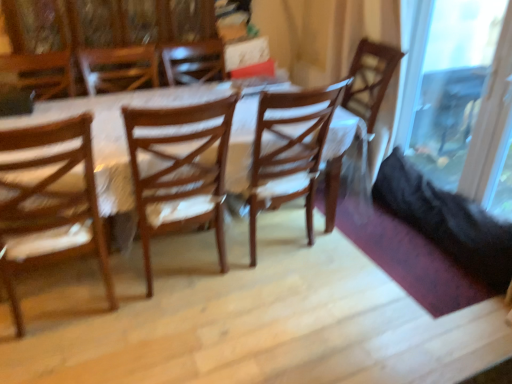
This screenshot has height=384, width=512. I want to click on free space to the right of wooden chair at left, the first chair in the left-to-right sequence, so (x=145, y=326).